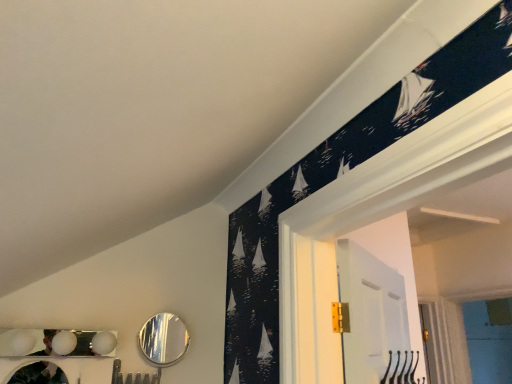
Measure the distance between shiny silver mirror at lower center, arranged as the second mirror when viewed from the front, and camera.

4.76 feet.

Describe the element at coordinates (163, 339) in the screenshot. I see `shiny silver mirror at lower center, arranged as the first mirror when viewed from the right` at that location.

You are a GUI agent. You are given a task and a screenshot of the screen. Output one action in this format:
    pyautogui.click(x=<x>, y=<y>)
    Task: Click on the shiny silver mirror at lower center, the second mirror in the left-to-right sequence
    The height and width of the screenshot is (384, 512).
    Given the screenshot: What is the action you would take?
    pyautogui.click(x=163, y=339)

The height and width of the screenshot is (384, 512). Describe the element at coordinates (39, 374) in the screenshot. I see `metallic silver mirror at lower left, acting as the 1th mirror starting from the front` at that location.

Identify the location of metallic silver mirror at lower left, which is the second mirror from back to front. This screenshot has height=384, width=512. (39, 374).

In order to click on shiny silver mirror at lower center, arranged as the first mirror when viewed from the right in this screenshot , I will do `click(163, 339)`.

Is shiny silver mirror at lower center, arranged as the first mirror when viewed from the right, to the left or to the right of metallic silver mirror at lower left, acting as the 1th mirror starting from the front, in the image?

From the image, it's evident that shiny silver mirror at lower center, arranged as the first mirror when viewed from the right, is to the right of metallic silver mirror at lower left, acting as the 1th mirror starting from the front.

Consider the image. Does shiny silver mirror at lower center, arranged as the second mirror when viewed from the front, come behind metallic silver mirror at lower left, acting as the 1th mirror starting from the front?

Yes, it is behind metallic silver mirror at lower left, acting as the 1th mirror starting from the front.

Is point (187, 340) behind point (19, 383)?

Yes, point (187, 340) is behind point (19, 383).

From the image's perspective, does shiny silver mirror at lower center, arranged as the first mirror when viewed from the right, appear higher than metallic silver mirror at lower left, acting as the 1th mirror starting from the front?

Indeed, from the image's perspective, shiny silver mirror at lower center, arranged as the first mirror when viewed from the right, is shown above metallic silver mirror at lower left, acting as the 1th mirror starting from the front.

From a real-world perspective, relative to metallic silver mirror at lower left, acting as the 1th mirror starting from the front, is shiny silver mirror at lower center, arranged as the second mirror when viewed from the front, vertically above or below?

Clearly, from a real-world perspective, shiny silver mirror at lower center, arranged as the second mirror when viewed from the front, is above metallic silver mirror at lower left, acting as the 1th mirror starting from the front.

In terms of width, does shiny silver mirror at lower center, positioned as the 1th mirror in back-to-front order, look wider or thinner when compared to metallic silver mirror at lower left, which appears as the 1th mirror when viewed from the left?

shiny silver mirror at lower center, positioned as the 1th mirror in back-to-front order, is thinner than metallic silver mirror at lower left, which appears as the 1th mirror when viewed from the left.

Is shiny silver mirror at lower center, the second mirror in the left-to-right sequence, shorter than metallic silver mirror at lower left, which is the second mirror from back to front?

No.

Does shiny silver mirror at lower center, arranged as the first mirror when viewed from the right, have a larger size compared to metallic silver mirror at lower left, marked as the 2th mirror in a right-to-left arrangement?

Yes, shiny silver mirror at lower center, arranged as the first mirror when viewed from the right, is bigger than metallic silver mirror at lower left, marked as the 2th mirror in a right-to-left arrangement.

Based on the photo, is shiny silver mirror at lower center, positioned as the 1th mirror in back-to-front order, situated inside metallic silver mirror at lower left, which appears as the 1th mirror when viewed from the left, or outside?

shiny silver mirror at lower center, positioned as the 1th mirror in back-to-front order, is not inside metallic silver mirror at lower left, which appears as the 1th mirror when viewed from the left, it's outside.

Are shiny silver mirror at lower center, arranged as the second mirror when viewed from the front, and metallic silver mirror at lower left, acting as the 1th mirror starting from the front, located far from each other?

No, shiny silver mirror at lower center, arranged as the second mirror when viewed from the front, is not far away from metallic silver mirror at lower left, acting as the 1th mirror starting from the front.

Could you tell me if shiny silver mirror at lower center, arranged as the first mirror when viewed from the right, is turned towards metallic silver mirror at lower left, marked as the 2th mirror in a right-to-left arrangement?

No.

Can you tell me how much shiny silver mirror at lower center, arranged as the second mirror when viewed from the front, and metallic silver mirror at lower left, marked as the 2th mirror in a right-to-left arrangement, differ in facing direction?

The angular difference between shiny silver mirror at lower center, arranged as the second mirror when viewed from the front, and metallic silver mirror at lower left, marked as the 2th mirror in a right-to-left arrangement, is 1.76 degrees.

How distant is shiny silver mirror at lower center, arranged as the second mirror when viewed from the front, from metallic silver mirror at lower left, acting as the 1th mirror starting from the front?

They are 32.74 centimeters apart.

Where is `mirror that appears behind the metallic silver mirror at lower left, acting as the 1th mirror starting from the front`? mirror that appears behind the metallic silver mirror at lower left, acting as the 1th mirror starting from the front is located at coordinates (163, 339).

Is metallic silver mirror at lower left, which is the second mirror from back to front, to the left or to the right of shiny silver mirror at lower center, arranged as the first mirror when viewed from the right, in the image?

In the image, metallic silver mirror at lower left, which is the second mirror from back to front, appears on the left side of shiny silver mirror at lower center, arranged as the first mirror when viewed from the right.

Is metallic silver mirror at lower left, acting as the 1th mirror starting from the front, in front of or behind shiny silver mirror at lower center, positioned as the 1th mirror in back-to-front order, in the image?

Clearly, metallic silver mirror at lower left, acting as the 1th mirror starting from the front, is in front of shiny silver mirror at lower center, positioned as the 1th mirror in back-to-front order.

Is point (27, 378) closer to viewer compared to point (181, 325)?

Yes, point (27, 378) is in front of point (181, 325).

From the image's perspective, between metallic silver mirror at lower left, acting as the 1th mirror starting from the front, and shiny silver mirror at lower center, arranged as the first mirror when viewed from the right, which one is located above?

From the image's view, shiny silver mirror at lower center, arranged as the first mirror when viewed from the right, is above.

From a real-world perspective, between metallic silver mirror at lower left, acting as the 1th mirror starting from the front, and shiny silver mirror at lower center, the second mirror in the left-to-right sequence, who is vertically higher?

shiny silver mirror at lower center, the second mirror in the left-to-right sequence.

Which object is wider, metallic silver mirror at lower left, which appears as the 1th mirror when viewed from the left, or shiny silver mirror at lower center, the second mirror in the left-to-right sequence?

metallic silver mirror at lower left, which appears as the 1th mirror when viewed from the left.

Is metallic silver mirror at lower left, marked as the 2th mirror in a right-to-left arrangement, taller or shorter than shiny silver mirror at lower center, the second mirror in the left-to-right sequence?

metallic silver mirror at lower left, marked as the 2th mirror in a right-to-left arrangement, is shorter than shiny silver mirror at lower center, the second mirror in the left-to-right sequence.

Which of these two, metallic silver mirror at lower left, which appears as the 1th mirror when viewed from the left, or shiny silver mirror at lower center, arranged as the second mirror when viewed from the front, is smaller?

metallic silver mirror at lower left, which appears as the 1th mirror when viewed from the left, is smaller.

Is metallic silver mirror at lower left, marked as the 2th mirror in a right-to-left arrangement, not inside shiny silver mirror at lower center, positioned as the 1th mirror in back-to-front order?

That's correct, metallic silver mirror at lower left, marked as the 2th mirror in a right-to-left arrangement, is outside of shiny silver mirror at lower center, positioned as the 1th mirror in back-to-front order.

From the picture: Would you consider metallic silver mirror at lower left, marked as the 2th mirror in a right-to-left arrangement, to be distant from shiny silver mirror at lower center, arranged as the first mirror when viewed from the right?

No.

Is metallic silver mirror at lower left, marked as the 2th mirror in a right-to-left arrangement, aimed at shiny silver mirror at lower center, arranged as the second mirror when viewed from the front?

No, metallic silver mirror at lower left, marked as the 2th mirror in a right-to-left arrangement, is not oriented towards shiny silver mirror at lower center, arranged as the second mirror when viewed from the front.

How many degrees apart are the facing directions of metallic silver mirror at lower left, which is the second mirror from back to front, and shiny silver mirror at lower center, arranged as the first mirror when viewed from the right?

The facing directions of metallic silver mirror at lower left, which is the second mirror from back to front, and shiny silver mirror at lower center, arranged as the first mirror when viewed from the right, are 1.76 degrees apart.

Find the location of a particular element. mirror below the shiny silver mirror at lower center, the second mirror in the left-to-right sequence (from a real-world perspective) is located at coordinates (39, 374).

In the image, there is a shiny silver mirror at lower center, the second mirror in the left-to-right sequence. Where is `mirror below it (from a real-world perspective)`? The width and height of the screenshot is (512, 384). mirror below it (from a real-world perspective) is located at coordinates (39, 374).

This screenshot has height=384, width=512. Find the location of `mirror that is above the metallic silver mirror at lower left, marked as the 2th mirror in a right-to-left arrangement (from a real-world perspective)`. mirror that is above the metallic silver mirror at lower left, marked as the 2th mirror in a right-to-left arrangement (from a real-world perspective) is located at coordinates pyautogui.click(x=163, y=339).